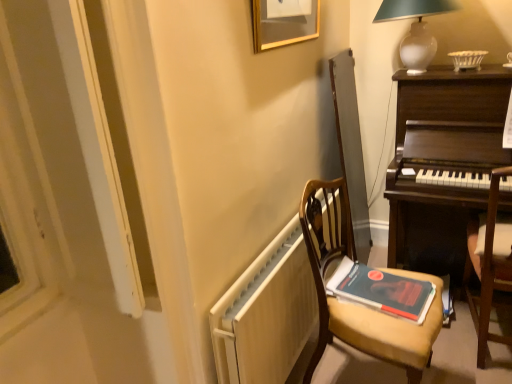
Locate an element on the screen. Image resolution: width=512 pixels, height=384 pixels. white matte radiator at lower center is located at coordinates (266, 313).

What is the approximate height of wooden chair at right, which is the 2th chair in left-to-right order?

It is 36.83 inches.

Image resolution: width=512 pixels, height=384 pixels. What are the coordinates of `wooden chair at right, which is the first chair from right to left` in the screenshot? It's located at (490, 268).

What do you see at coordinates (381, 290) in the screenshot?
I see `hardcover book at center` at bounding box center [381, 290].

The width and height of the screenshot is (512, 384). Describe the element at coordinates (443, 162) in the screenshot. I see `dark wood piano at right` at that location.

This screenshot has height=384, width=512. Identify the location of gold-framed picture at upper center. (282, 26).

Is hardcover book at center positioned with its back to dark wood piano at right?

Answer: That's not correct — hardcover book at center is not looking away from dark wood piano at right.

Can you tell me how much hardcover book at center and dark wood piano at right differ in facing direction?

hardcover book at center and dark wood piano at right are facing 83.5 degrees away from each other.

Is hardcover book at center at the right side of dark wood piano at right?

No, hardcover book at center is not to the right of dark wood piano at right.

From the image's perspective, is hardcover book at center on dark wood piano at right?

No, from the image's perspective, hardcover book at center is not over dark wood piano at right.

Is gold-framed picture at upper center inside or outside of white matte radiator at lower center?

gold-framed picture at upper center is not inside white matte radiator at lower center, it's outside.

Can you see gold-framed picture at upper center touching white matte radiator at lower center?

They are not placed beside each other.

Is gold-framed picture at upper center turned away from white matte radiator at lower center?

No, gold-framed picture at upper center is not facing the opposite direction of white matte radiator at lower center.

Looking at this image, from a real-world perspective, which object stands above the other?

white glass table lamp at upper right is physically above.

Find the location of a particular element. table lamp positioned vertically above the wooden chair at center, the 1th chair viewed from the left (from a real-world perspective) is located at coordinates (415, 29).

Measure the distance from wooden chair at center, the 1th chair viewed from the left, to white glass table lamp at upper right.

They are 1.03 meters apart.

Can you confirm if wooden chair at center, the second chair viewed from the right, is thinner than white glass table lamp at upper right?

No.

Between gold-framed picture at upper center and hardcover book at center, which one appears on the right side from the viewer's perspective?

From the viewer's perspective, hardcover book at center appears more on the right side.

The height and width of the screenshot is (384, 512). There is a hardcover book at center. In order to click on picture frame above it (from a real-world perspective) in this screenshot , I will do `click(282, 26)`.

Is gold-framed picture at upper center smaller than hardcover book at center?

Incorrect, gold-framed picture at upper center is not smaller in size than hardcover book at center.

Consider the image. Is gold-framed picture at upper center spatially inside hardcover book at center, or outside of it?

gold-framed picture at upper center is not enclosed by hardcover book at center.

In the scene shown: Is white matte radiator at lower center shorter than hardcover book at center?

No.

Between point (232, 321) and point (391, 300), which one is positioned behind?

The point (391, 300) is more distant.

From the image's perspective, is white matte radiator at lower center over hardcover book at center?

Actually, white matte radiator at lower center appears below hardcover book at center in the image.

How many degrees apart are the facing directions of white matte radiator at lower center and hardcover book at center?

They differ by 6.28 degrees in their facing directions.

Is white glass table lamp at upper right aimed at hardcover book at center?

No, white glass table lamp at upper right is not oriented towards hardcover book at center.

From the image's perspective, between white glass table lamp at upper right and hardcover book at center, who is located below?

hardcover book at center, from the image's perspective.

Is point (378, 18) closer to camera compared to point (328, 289)?

That is False.

Can you confirm if white glass table lamp at upper right is bigger than hardcover book at center?

Correct, white glass table lamp at upper right is larger in size than hardcover book at center.

Could you tell me if white matte radiator at lower center is turned towards gold-framed picture at upper center?

No, white matte radiator at lower center is not aimed at gold-framed picture at upper center.

Considering the positions of point (274, 304) and point (314, 23), is point (274, 304) closer or farther from the camera than point (314, 23)?

Point (274, 304) appears to be closer to the viewer than point (314, 23).

Which object is further away from the camera, white matte radiator at lower center or gold-framed picture at upper center?

Positioned behind is gold-framed picture at upper center.

Is white matte radiator at lower center to the right of gold-framed picture at upper center from the viewer's perspective?

Yes.

Identify the location of desk on the right side of hardcover book at center. This screenshot has width=512, height=384. (443, 162).

The height and width of the screenshot is (384, 512). Identify the location of radiator in front of the gold-framed picture at upper center. (266, 313).

When comparing their distances from white matte radiator at lower center, does gold-framed picture at upper center or dark wood piano at right seem closer?

dark wood piano at right is closer to white matte radiator at lower center.

Which object lies further to the anchor point gold-framed picture at upper center, wooden chair at right, which is the first chair from right to left, or white glass table lamp at upper right?

The object further to gold-framed picture at upper center is wooden chair at right, which is the first chair from right to left.

Based on their spatial positions, is wooden chair at right, which is the 2th chair in left-to-right order, or gold-framed picture at upper center further from dark wood piano at right?

The object further to dark wood piano at right is gold-framed picture at upper center.

Looking at the image, which one is located closer to wooden chair at center, the second chair viewed from the right, dark wood piano at right or hardcover book at center?

The object closer to wooden chair at center, the second chair viewed from the right, is hardcover book at center.

Based on their spatial positions, is white matte radiator at lower center or hardcover book at center further from gold-framed picture at upper center?

hardcover book at center lies further to gold-framed picture at upper center than the other object.

Looking at the image, which one is located further to white matte radiator at lower center, hardcover book at center or white glass table lamp at upper right?

The object further to white matte radiator at lower center is white glass table lamp at upper right.

When comparing their distances from wooden chair at center, the second chair viewed from the right, does white glass table lamp at upper right or white matte radiator at lower center seem further?

The object further to wooden chair at center, the second chair viewed from the right, is white glass table lamp at upper right.

Estimate the real-world distances between objects in this image. Which object is closer to wooden chair at right, which is the first chair from right to left, wooden chair at center, the second chair viewed from the right, or hardcover book at center?

Among the two, hardcover book at center is located nearer to wooden chair at right, which is the first chair from right to left.

Where is `desk situated between white matte radiator at lower center and wooden chair at right, which is the 2th chair in left-to-right order, from left to right`? The image size is (512, 384). desk situated between white matte radiator at lower center and wooden chair at right, which is the 2th chair in left-to-right order, from left to right is located at coordinates (443, 162).

At what (x,y) coordinates should I click in order to perform the action: click on chair situated between white matte radiator at lower center and dark wood piano at right from left to right. Please return your answer as a coordinate pair (x, y). Looking at the image, I should click on (357, 305).

Identify the location of chair between white glass table lamp at upper right and wooden chair at center, the second chair viewed from the right, in the vertical direction. (490, 268).

In order to click on chair between white matte radiator at lower center and hardcover book at center in this screenshot , I will do `click(357, 305)`.